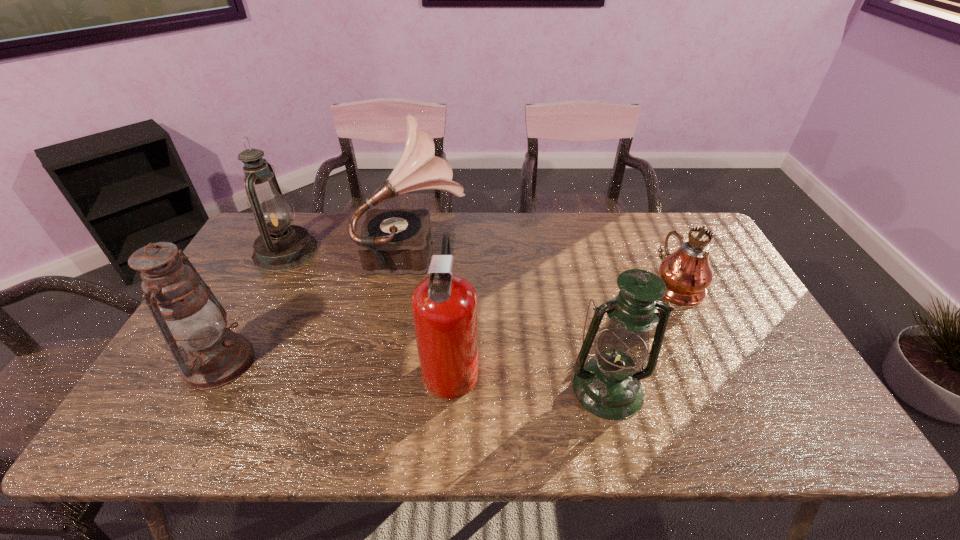
Locate an element on the screen. The height and width of the screenshot is (540, 960). object that is positioned at the near edge is located at coordinates (608, 385).

Locate an element on the screen. The height and width of the screenshot is (540, 960). object that is at the right edge is located at coordinates (687, 273).

Locate an element on the screen. object that is at the far left corner is located at coordinates (280, 246).

Find the location of a particular element. The image size is (960, 540). free space at the far edge of the desktop is located at coordinates (497, 253).

Image resolution: width=960 pixels, height=540 pixels. What are the coordinates of `vacant space at the near edge` in the screenshot? It's located at (457, 411).

What are the coordinates of `vacant area at the left edge` in the screenshot? It's located at (173, 364).

Where is `vacant space at the right edge of the desktop`? vacant space at the right edge of the desktop is located at coordinates (737, 303).

Locate an element on the screen. free region at the far right corner is located at coordinates (653, 220).

Locate an element on the screen. vacant space at the near right corner of the desktop is located at coordinates (753, 417).

Identify the location of blank region between the fifth object from left to right and the fire extinguisher. (529, 376).